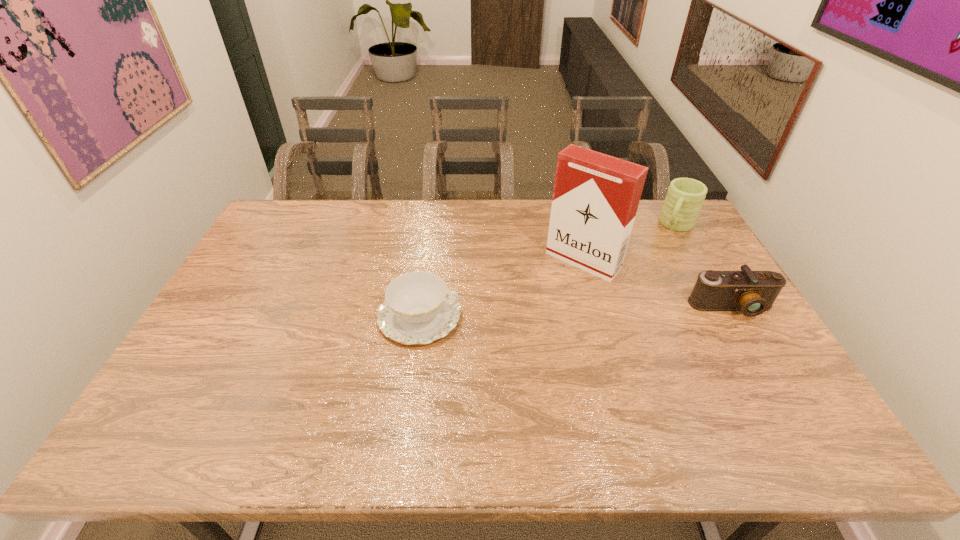
In the image, there is a desktop. Identify the location of vacant space at the near edge. tap(272, 380).

Identify the location of vacant area at the left edge of the desktop. coord(260,254).

This screenshot has width=960, height=540. Find the location of `free space at the right edge of the desktop`. free space at the right edge of the desktop is located at coordinates (692, 248).

Find the location of a particular element. This screenshot has width=960, height=540. vacant space at the far right corner of the desktop is located at coordinates (661, 203).

Find the location of a particular element. The width and height of the screenshot is (960, 540). unoccupied area between the third shortest object and the tallest object is located at coordinates (630, 243).

I want to click on free spot between the second farthest object and the mug, so click(x=630, y=243).

Where is `free area in between the camera and the shortest object`? free area in between the camera and the shortest object is located at coordinates (576, 312).

Locate an element on the screen. The height and width of the screenshot is (540, 960). vacant space that is in between the shortest object and the tallest object is located at coordinates (501, 288).

Where is `vacant point located between the third shortest object and the leftmost object`? vacant point located between the third shortest object and the leftmost object is located at coordinates (548, 271).

The height and width of the screenshot is (540, 960). Identify the location of vacant space that's between the farthest object and the second farthest object. (630, 243).